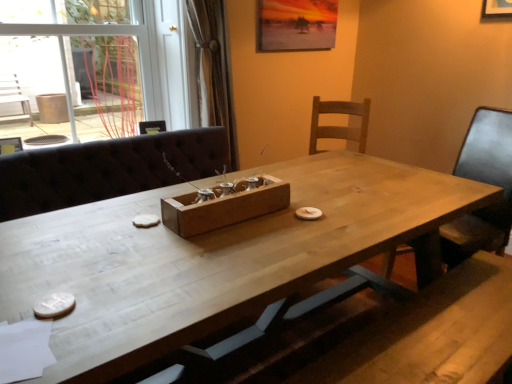
Question: Is transparent glass door at upper left spatially inside white wood table at center, or outside of it?

Choices:
 (A) inside
 (B) outside

Answer: (B)

Question: From a real-world perspective, is transparent glass door at upper left above or below white wood table at center?

Choices:
 (A) below
 (B) above

Answer: (B)

Question: Considering the real-world distances, which object is farthest from the transparent glass door at upper left?

Choices:
 (A) wooden tray at center
 (B) wooden chair at right
 (C) white wood table at center

Answer: (B)

Question: Estimate the real-world distances between objects in this image. Which object is farther from the wooden chair at right?

Choices:
 (A) white wood table at center
 (B) wooden tray at center
 (C) transparent glass door at upper left

Answer: (C)